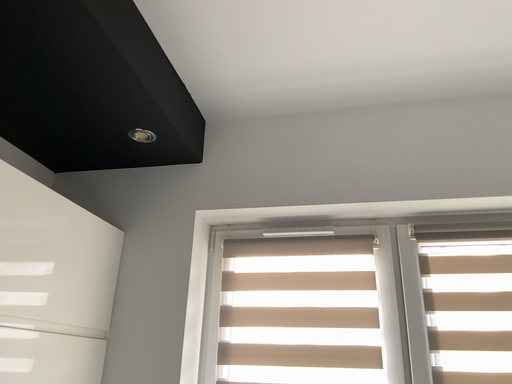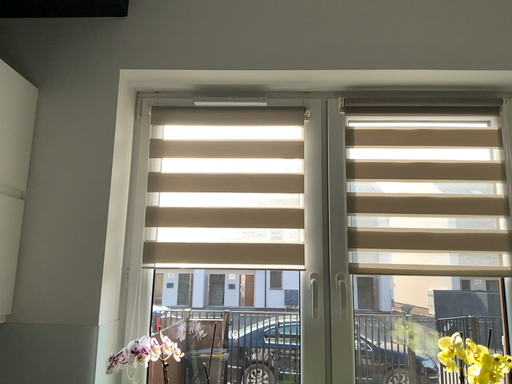
Question: How did the camera likely rotate when shooting the video?

Choices:
 (A) rotated downward
 (B) rotated upward

Answer: (A)